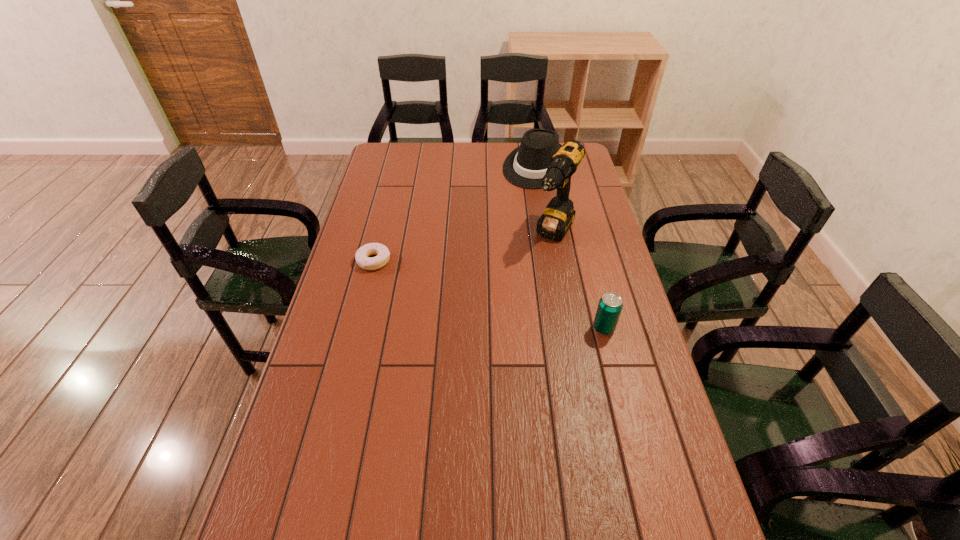
You are a GUI agent. You are given a task and a screenshot of the screen. Output one action in this format:
    pyautogui.click(x=<x>, y=<y>)
    Task: Click on the doughnut
    
    Given the screenshot: What is the action you would take?
    pyautogui.click(x=362, y=258)

In order to click on the leftmost object in this screenshot , I will do `click(362, 258)`.

Identify the location of the nearest object. (610, 306).

Where is `drill`? drill is located at coordinates (556, 220).

The height and width of the screenshot is (540, 960). In order to click on fedora in this screenshot , I will do `click(526, 165)`.

Locate an element on the screen. free spot located on the front of the leftmost object is located at coordinates (354, 339).

Where is `vacant space located 0.330m on the left of the beer can`? The image size is (960, 540). vacant space located 0.330m on the left of the beer can is located at coordinates (478, 328).

This screenshot has width=960, height=540. I want to click on free space located at the tip of the tallest object, so click(x=537, y=275).

You are a GUI agent. You are given a task and a screenshot of the screen. Output one action in this format:
    pyautogui.click(x=<x>, y=<y>)
    Task: Click on the free spot located 0.140m at the tip of the tallest object
    
    Given the screenshot: What is the action you would take?
    pyautogui.click(x=534, y=281)

The height and width of the screenshot is (540, 960). I want to click on blank space located 0.280m at the tip of the tallest object, so click(x=516, y=312).